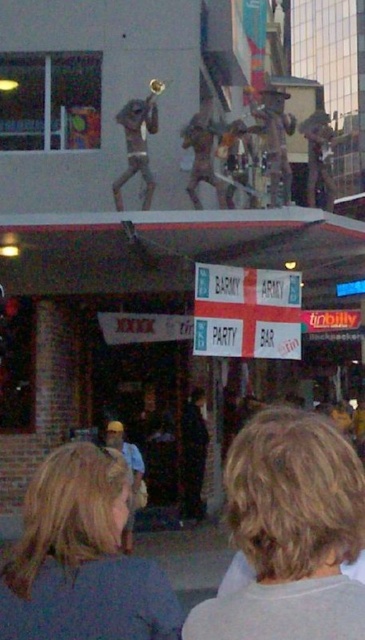
You are a photographer trying to capture both the blonde hair at center and the bronze statue at upper center in a single frame. Based on their sizes in the image, which one would you need to focus on more to ensure both are clearly visible?

The bronze statue at upper center is larger than the blonde hair at center, so you should focus on the bronze statue at upper center to ensure both are clearly visible.

Looking at this image, you are standing at the bus stop with the red roof and want to take a photo of both the point at coordinates point (255, 592) and point (155, 116). Which point should you focus on first to ensure both are in focus?

You should focus on point (255, 592) first because it is closer to the camera than point (155, 116), ensuring both points are within the depth of field.

You are a photographer trying to capture both the blonde hair at center and the bronze statue at upper center in the same frame. Based on their positions, which object is located to the right of the other?

The blonde hair at center is positioned on the right side of bronze statue at upper center.